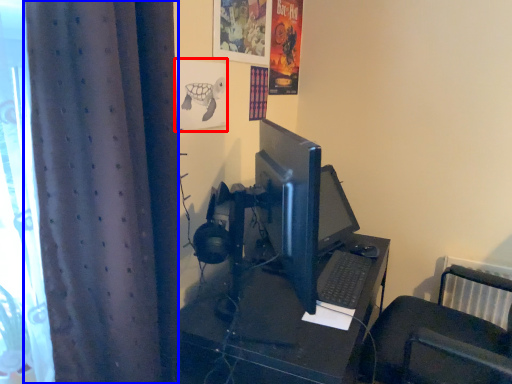
Question: Which point is closer to the camera, poster page (highlighted by a red box) or curtain (highlighted by a blue box)?

Choices:
 (A) poster page
 (B) curtain

Answer: (B)